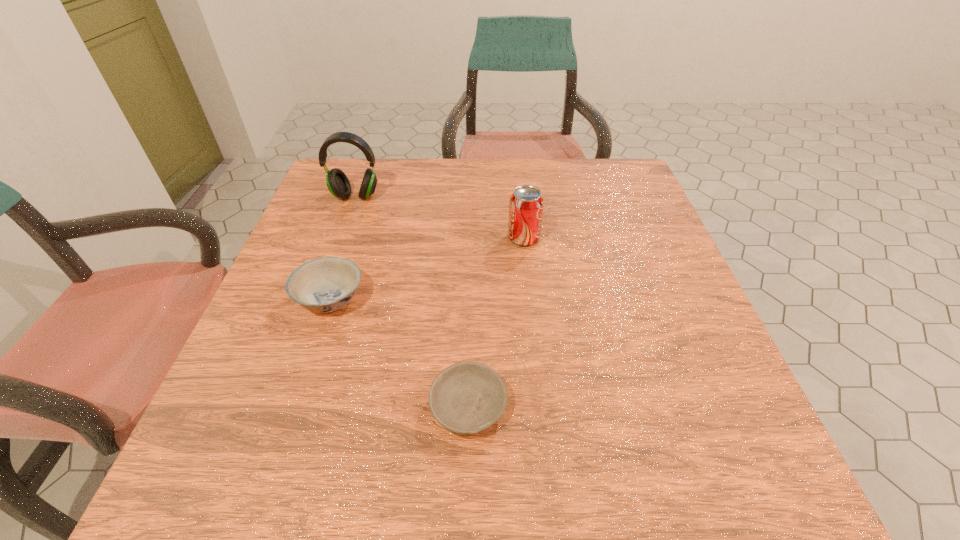
This screenshot has width=960, height=540. In the image, there is a desktop. Find the location of `vacant space at the right edge`. vacant space at the right edge is located at coordinates (618, 307).

Find the location of a particular element. This screenshot has width=960, height=540. free region at the far right corner of the desktop is located at coordinates (579, 173).

Identify the location of vacant space at the near right corner. [x=686, y=475].

Locate an element on the screen. free area in between the third shortest object and the third object from left to right is located at coordinates (496, 322).

This screenshot has height=540, width=960. Find the location of `vacant area that lies between the shorter bowl and the second farthest object`. vacant area that lies between the shorter bowl and the second farthest object is located at coordinates (496, 322).

This screenshot has width=960, height=540. I want to click on free space between the third shortest object and the tallest object, so click(440, 217).

The image size is (960, 540). Identify the location of vacant area that lies between the second farthest object and the headset. (440, 217).

This screenshot has height=540, width=960. Identify the location of unoccupied position between the nearer bowl and the soda can. (496, 322).

Where is `blank region between the third object from left to right and the farthest object`? blank region between the third object from left to right and the farthest object is located at coordinates (412, 302).

Where is `free area in between the second farthest object and the nearer bowl`? Image resolution: width=960 pixels, height=540 pixels. free area in between the second farthest object and the nearer bowl is located at coordinates (496, 322).